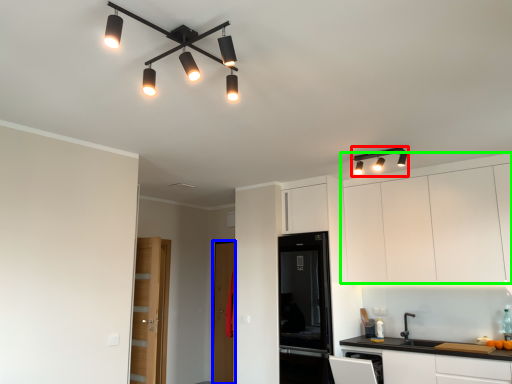
Question: Estimate the real-world distances between objects in this image. Which object is farther from light fixture (highlighted by a red box), glass door (highlighted by a blue box) or cabinetry (highlighted by a green box)?

Choices:
 (A) glass door
 (B) cabinetry

Answer: (A)